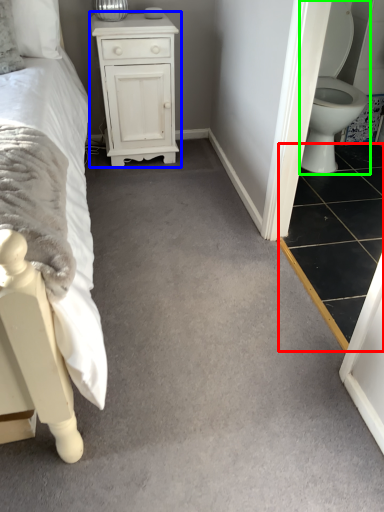
Question: Which object is positioned farthest from tile (highlighted by a red box)? Select from chest of drawers (highlighted by a blue box) and toilet (highlighted by a green box).

Choices:
 (A) chest of drawers
 (B) toilet

Answer: (A)